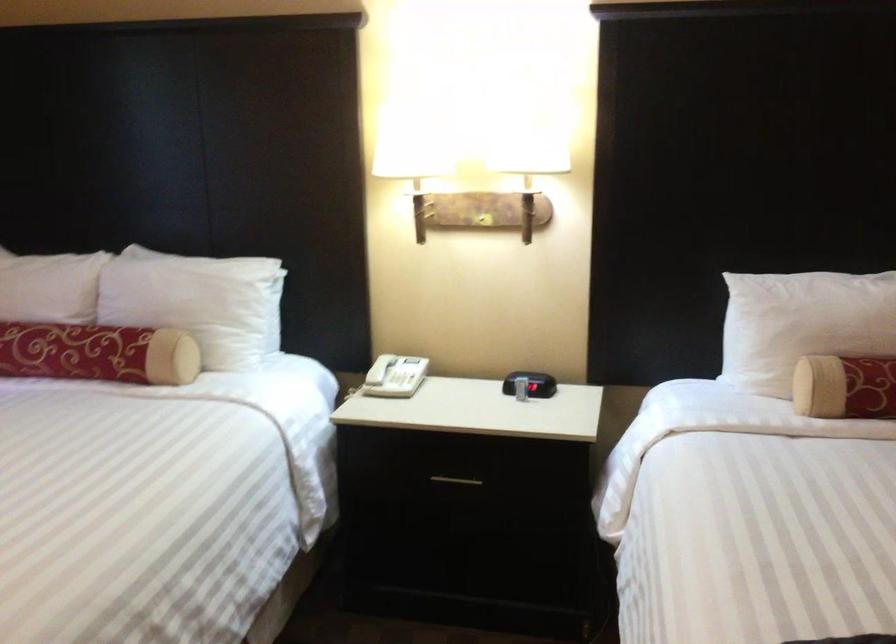
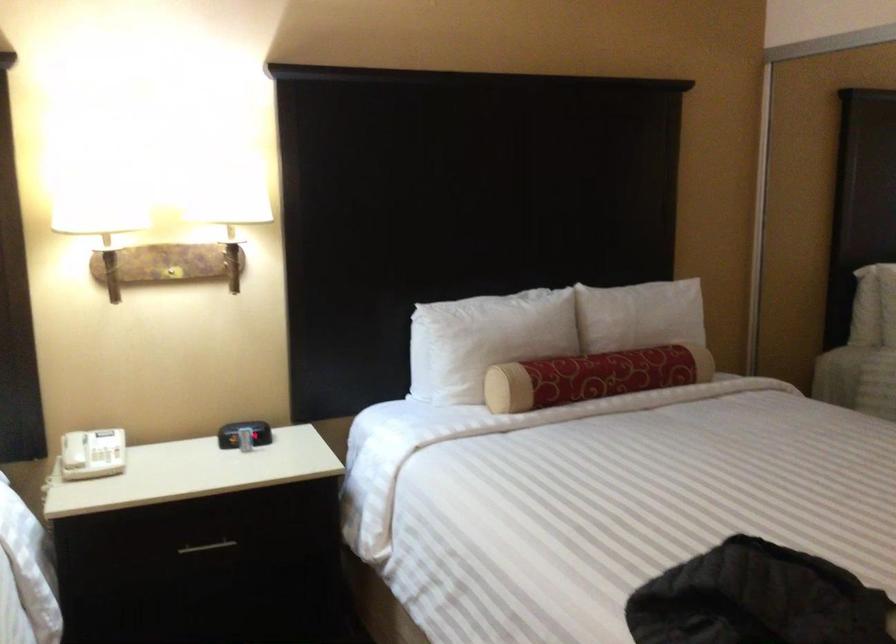
In the second image, find the point that corresponds to (805,319) in the first image.

(485, 339)